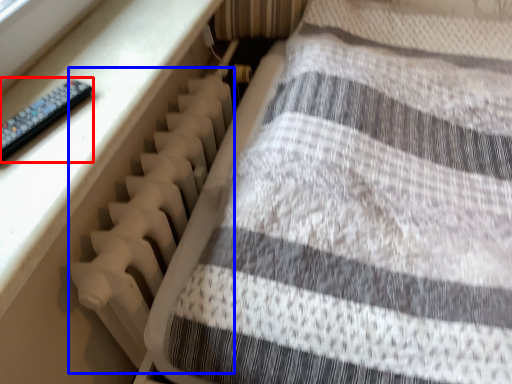
Question: Among these objects, which one is farthest to the camera, control (highlighted by a red box) or radiator (highlighted by a blue box)?

Choices:
 (A) control
 (B) radiator

Answer: (B)